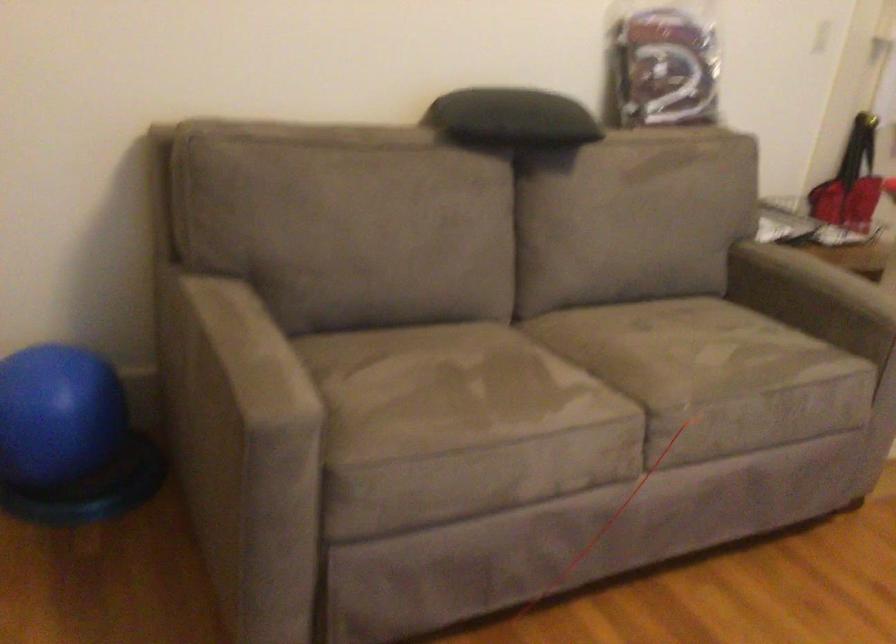
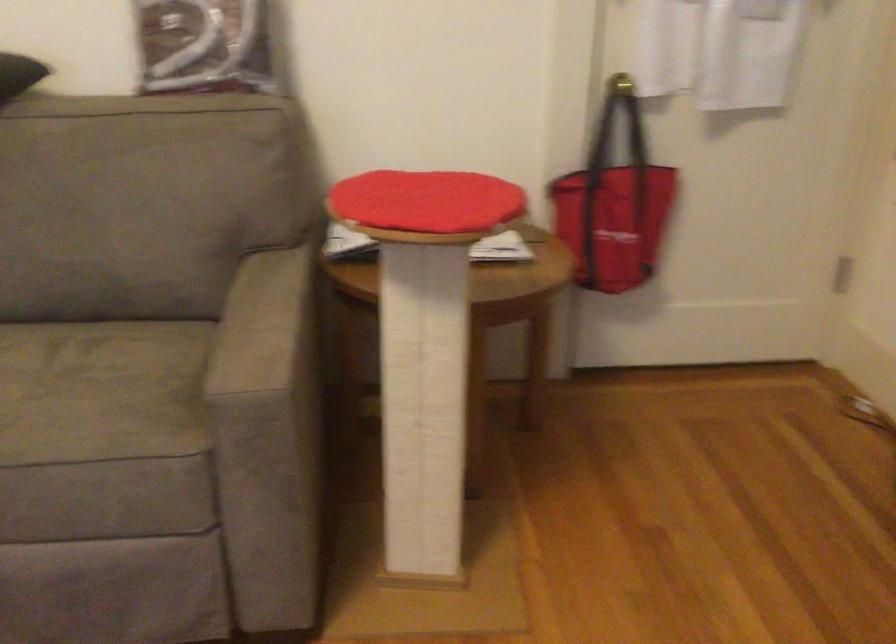
Locate, in the second image, the point that corresponds to pixel 762 337 in the first image.

(101, 391)